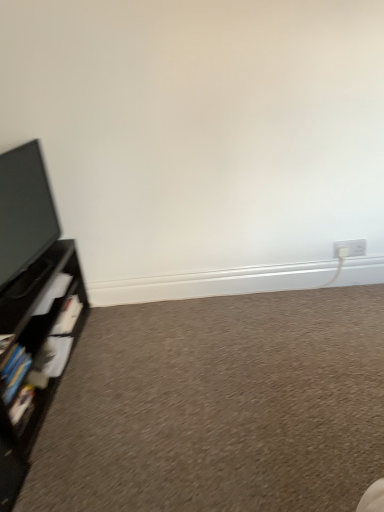
Question: Considering their positions, is black matte shelf at left located in front of or behind white plastic electric outlet at lower right?

Choices:
 (A) behind
 (B) front

Answer: (B)

Question: Is black matte shelf at left wider or thinner than white plastic electric outlet at lower right?

Choices:
 (A) thin
 (B) wide

Answer: (B)

Question: Which is nearer to the carpet at lower left?

Choices:
 (A) black matte shelf at left
 (B) white plastic electric outlet at lower right

Answer: (A)

Question: Estimate the real-world distances between objects in this image. Which object is farther from the black matte shelf at left?

Choices:
 (A) white plastic electric outlet at lower right
 (B) carpet at lower left

Answer: (A)